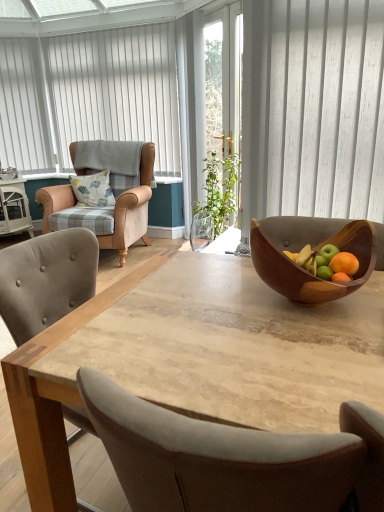
Question: From a real-world perspective, is wooden bowl at center above or below transparent glass screen door at center?

Choices:
 (A) above
 (B) below

Answer: (B)

Question: Is wooden bowl at center taller or shorter than transparent glass screen door at center?

Choices:
 (A) tall
 (B) short

Answer: (B)

Question: Based on their relative distances, which object is farther from the white vertical blinds at upper left?

Choices:
 (A) wooden bowl at center
 (B) white glossy side table at left
 (C) natural wood table at center
 (D) transparent glass screen door at center
 (E) beige leather armchair at left

Answer: (A)

Question: Which object is positioned farthest from the wooden bowl at center?

Choices:
 (A) white vertical blinds at upper left
 (B) white vertical blinds at upper left
 (C) floral fabric pillow at left
 (D) natural wood table at center
 (E) transparent glass screen door at center

Answer: (B)